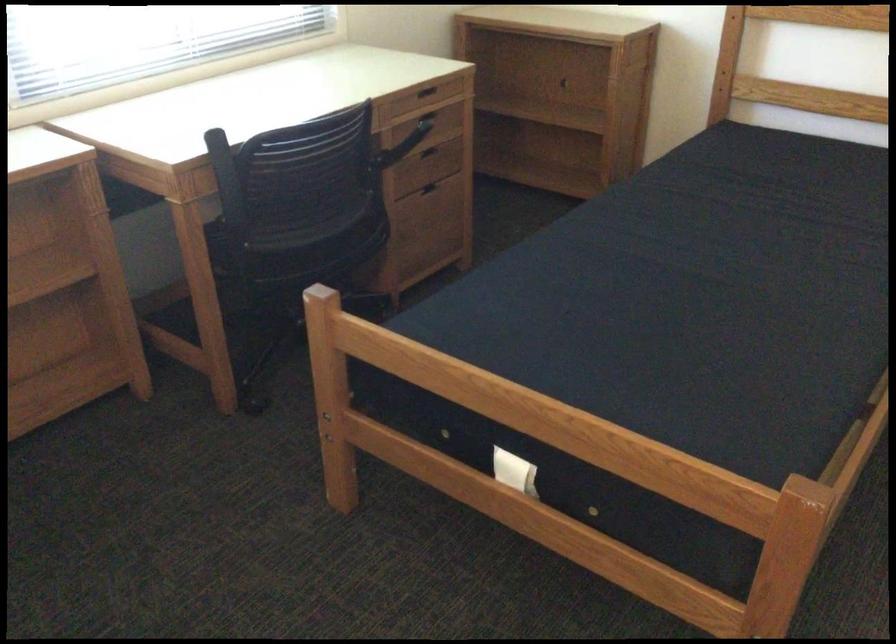
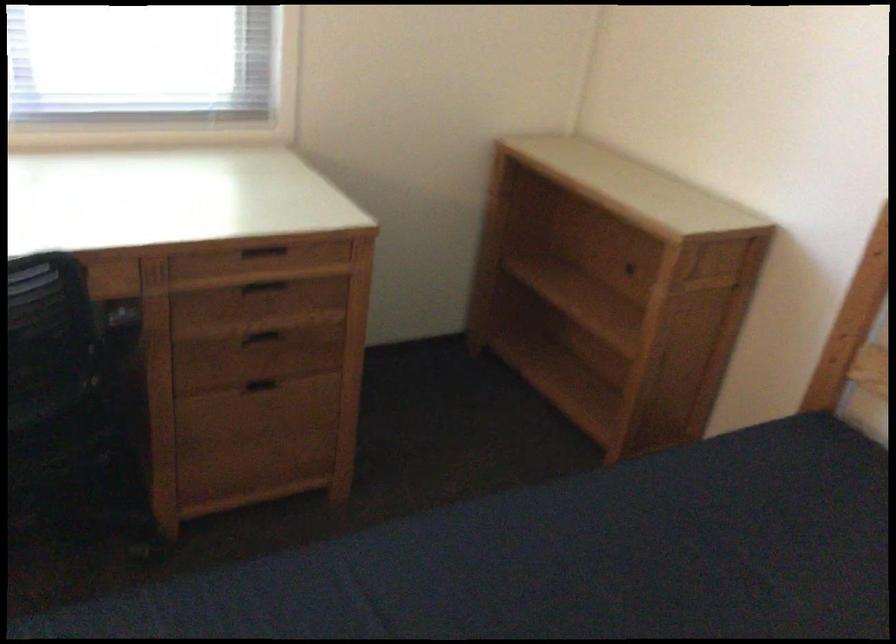
Find the pixel in the second image that matches the point at 432,114 in the first image.

(263, 285)